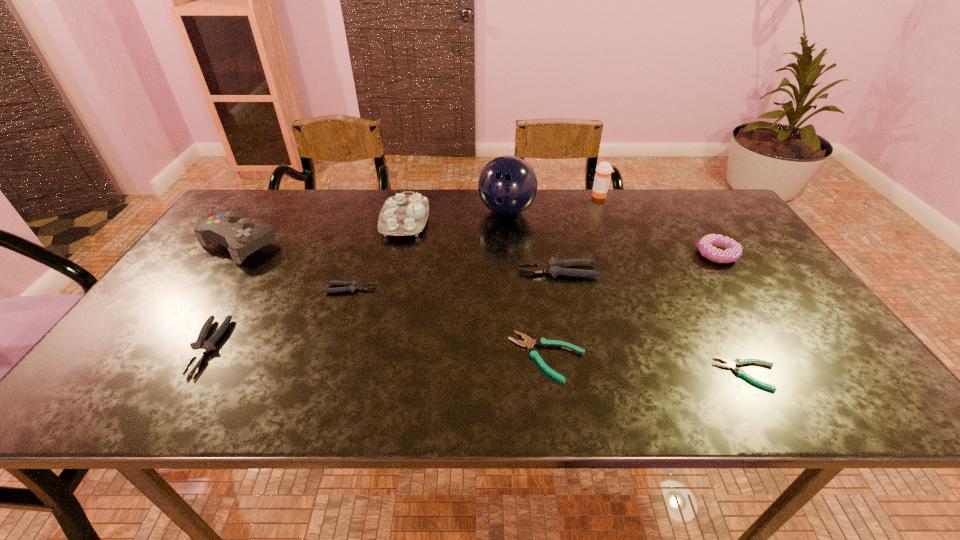
Where is `empty space that is in between the farthest gray pliers and the blue chinaware`? Image resolution: width=960 pixels, height=540 pixels. empty space that is in between the farthest gray pliers and the blue chinaware is located at coordinates (481, 246).

Identify the location of vacant point located between the blue bowling ball and the control. (373, 227).

This screenshot has height=540, width=960. I want to click on vacant area between the leftmost pliers and the fourth nearest object, so click(279, 318).

Find the location of `blank region between the purple doughnut and the control`. blank region between the purple doughnut and the control is located at coordinates (478, 249).

Locate an element on the screen. The width and height of the screenshot is (960, 540). vacant space that's between the bigger teal pliers and the fifth shortest object is located at coordinates (552, 314).

This screenshot has width=960, height=540. Identify the location of object that stands as the sixth closest to the tallest object. (730, 250).

The image size is (960, 540). In order to click on object identified as the seventh closest to the fourth pliers from right to left in this screenshot , I will do `click(603, 171)`.

Choose which pliers is the nearest neighbor to the purple doughnut. Please provide its 2D coordinates. Your answer should be formatted as a tuple, i.e. [(x, y)], where the tuple contains the x and y coordinates of a point satisfying the conditions above.

[(554, 267)]

Identify which pliers is the fourth nearest to the leftmost pliers. Please provide its 2D coordinates. Your answer should be formatted as a tuple, i.e. [(x, y)], where the tuple contains the x and y coordinates of a point satisfying the conditions above.

[(737, 362)]

Image resolution: width=960 pixels, height=540 pixels. Find the location of `gray pliers that stands as the closest to the eighth object from left to right`. gray pliers that stands as the closest to the eighth object from left to right is located at coordinates (x=554, y=267).